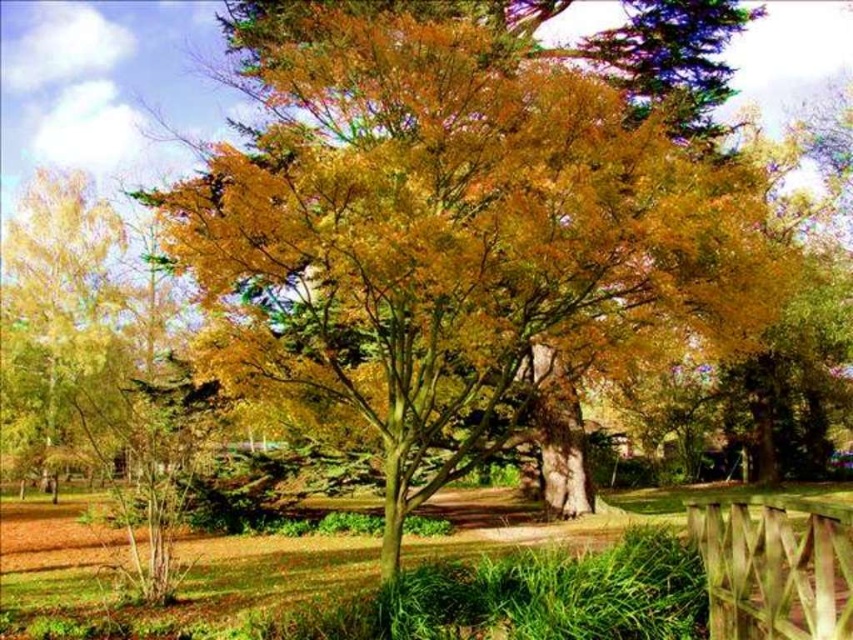
Who is more forward, (262, 198) or (47, 349)?

Point (262, 198)

Is golden yellow leaves at center bigger than golden yellow leaves at left?

Correct, golden yellow leaves at center is larger in size than golden yellow leaves at left.

Between point (543, 145) and point (50, 225), which one is positioned in front?

Point (543, 145) is more forward.

What are the coordinates of `golden yellow leaves at center` in the screenshot? It's located at (463, 225).

Is point (700, 280) farther from camera compared to point (753, 534)?

That is True.

Does point (543, 198) come farther from viewer compared to point (793, 560)?

Yes, point (543, 198) is farther from viewer.

Locate an element on the screen. golden yellow leaves at center is located at coordinates (463, 225).

Can you confirm if golden yellow leaves at left is shorter than wooden fence at lower right?

No.

Is the position of golden yellow leaves at left less distant than that of wooden fence at lower right?

No, golden yellow leaves at left is further to the viewer.

Is point (38, 355) behind point (845, 582)?

Yes, point (38, 355) is farther from viewer.

The image size is (853, 640). I want to click on golden yellow leaves at left, so click(54, 305).